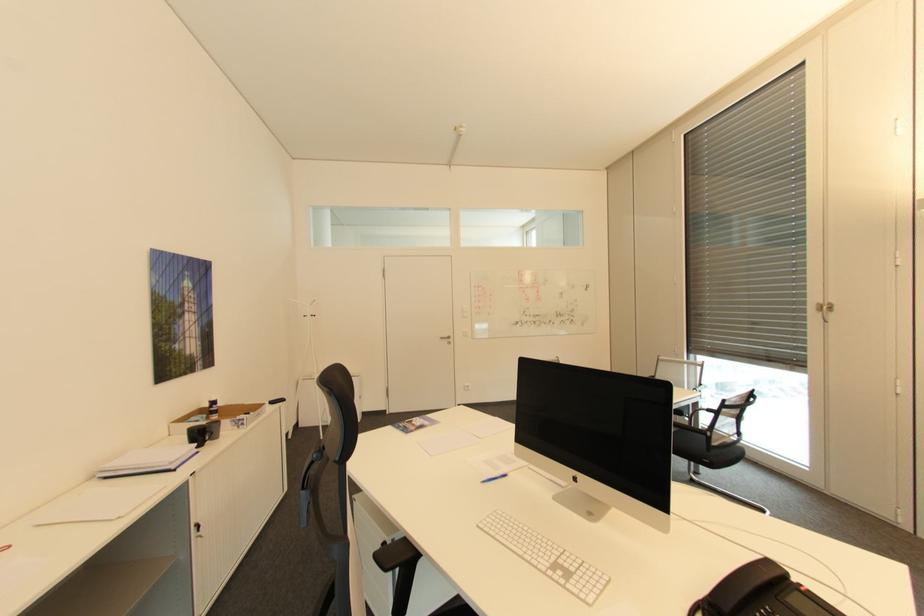
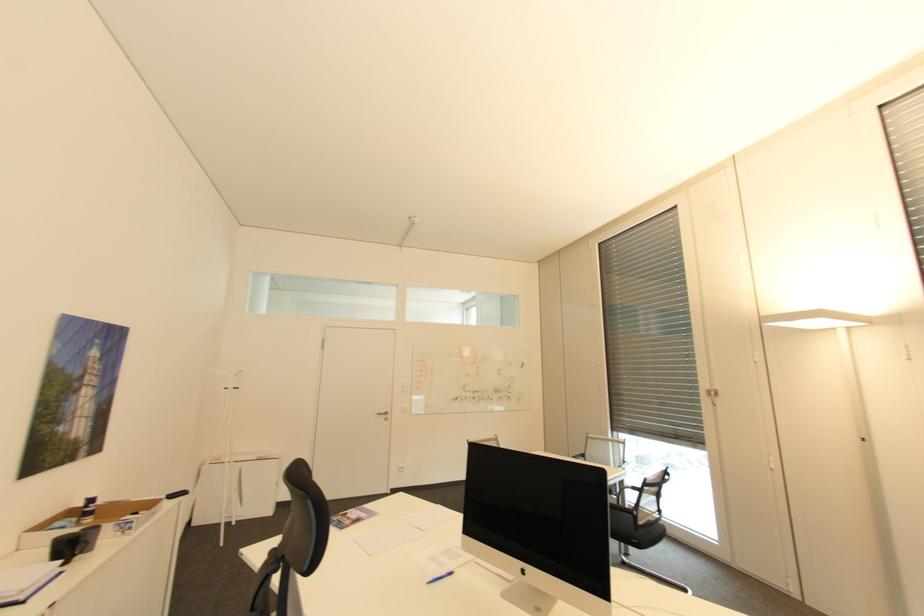
Question: Based on the continuous images, in which direction is the camera rotating? Reply with the corresponding letter.

Choices:
 (A) Left
 (B) Right
 (C) Up
 (D) Down

Answer: (C)